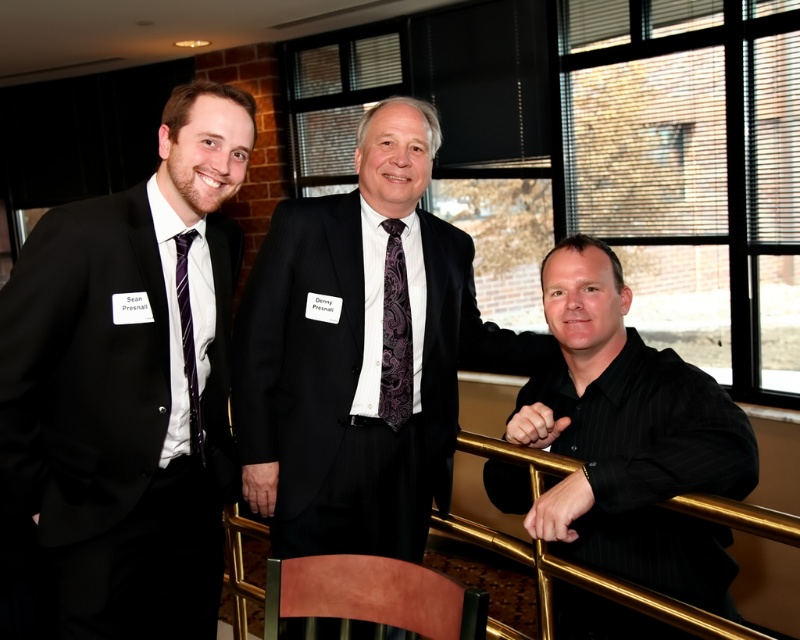
You are at a formal event and need to greet the person wearing the matte black suit at left and the matte black suit at center. Which one should you approach first if you want to greet the person who is closer to you?

You should approach the matte black suit at left first because it is closer to the viewer than the matte black suit at center.

In the scene shown: You are organizing a photo shoot and need to arrange the models in order from left to right based on their clothing items. Given the matte black suit at left and the purple paisley tie at center, which clothing item should be placed first when arranging from left to right?

The matte black suit at left should be placed first when arranging from left to right because it is positioned to the left of the purple paisley tie at center.